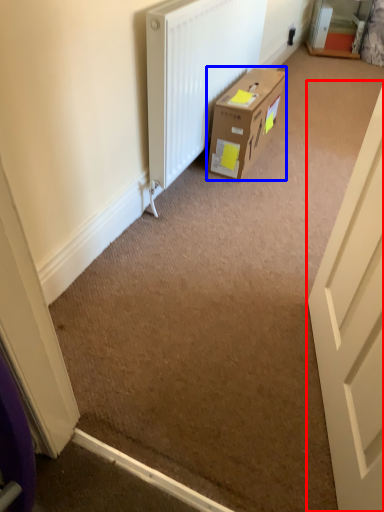
Question: Among these objects, which one is nearest to the camera, door (highlighted by a red box) or box (highlighted by a blue box)?

Choices:
 (A) door
 (B) box

Answer: (A)